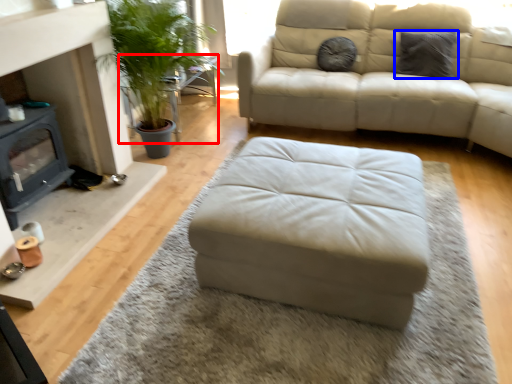
Question: Which of the following is the closest to the observer, table (highlighted by a red box) or pillow (highlighted by a blue box)?

Choices:
 (A) table
 (B) pillow

Answer: (B)